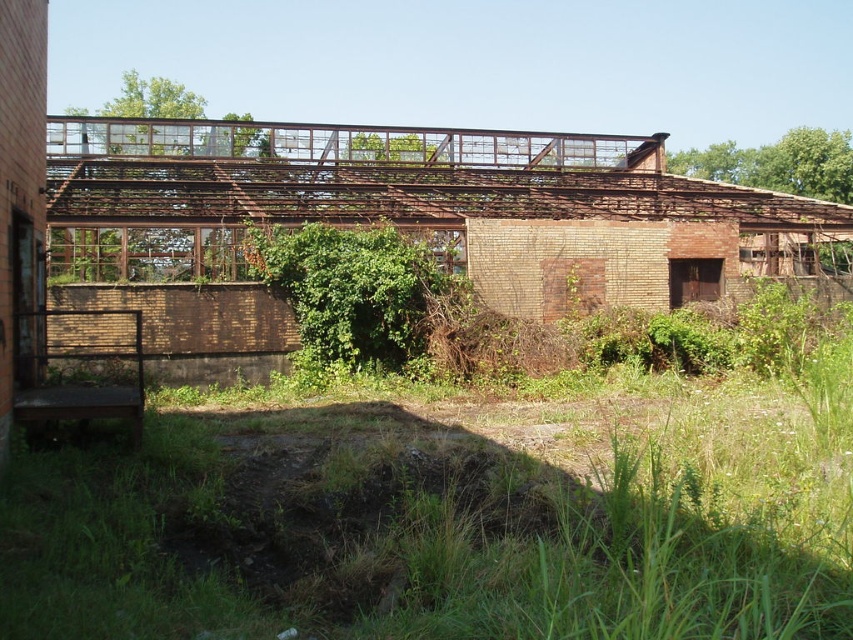
Question: Is green grass at lower center smaller than green leafy bush at center?

Choices:
 (A) no
 (B) yes

Answer: (A)

Question: Can you confirm if green grass at lower center is positioned above green leafy bush at center?

Choices:
 (A) no
 (B) yes

Answer: (A)

Question: Considering the relative positions of green grass at lower center and green leafy bush at center in the image provided, where is green grass at lower center located with respect to green leafy bush at center?

Choices:
 (A) left
 (B) right

Answer: (B)

Question: Which of the following is the farthest from the observer?

Choices:
 (A) green leafy bush at center
 (B) green grass at lower center

Answer: (A)

Question: Which object is closer to the camera taking this photo?

Choices:
 (A) green leafy bush at center
 (B) green grass at lower center

Answer: (B)